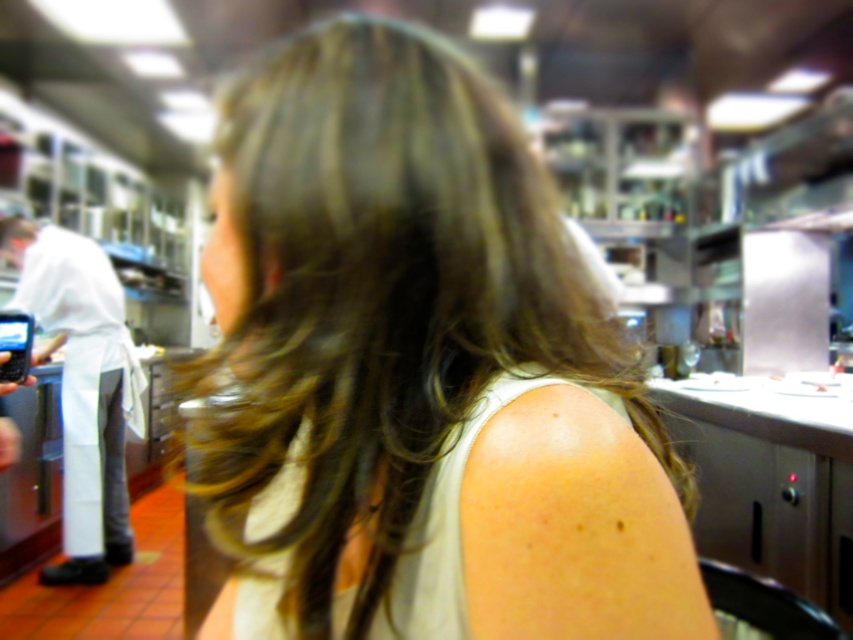
Question: Which object is positioned farthest from the black plastic phone at left?

Choices:
 (A) white fabric apron at left
 (B) brown wavy hair at center

Answer: (B)

Question: Which point is closer to the camera taking this photo?

Choices:
 (A) (300, 109)
 (B) (16, 342)
 (C) (97, 540)

Answer: (A)

Question: Is brown wavy hair at center bigger than white fabric apron at left?

Choices:
 (A) no
 (B) yes

Answer: (A)

Question: Considering the real-world distances, which object is closest to the brown wavy hair at center?

Choices:
 (A) white fabric apron at left
 (B) black plastic phone at left

Answer: (B)

Question: Is brown wavy hair at center smaller than black plastic phone at left?

Choices:
 (A) no
 (B) yes

Answer: (A)

Question: From the image, what is the correct spatial relationship of white fabric apron at left in relation to black plastic phone at left?

Choices:
 (A) left
 (B) right

Answer: (A)